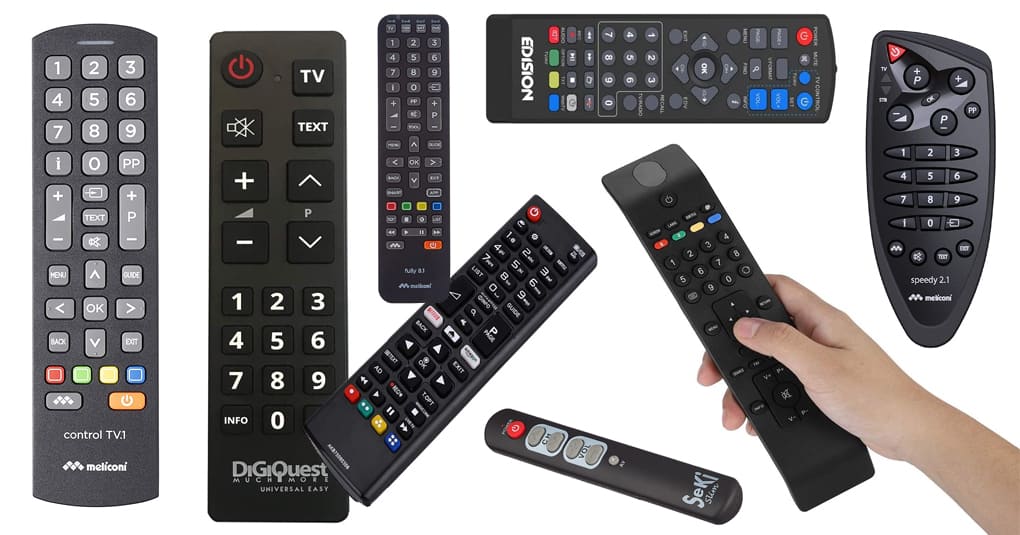
Locate an element on the screen. number of remotes is located at coordinates (68, 179), (293, 231), (428, 185), (471, 296), (636, 79), (713, 261), (959, 212), (606, 457).